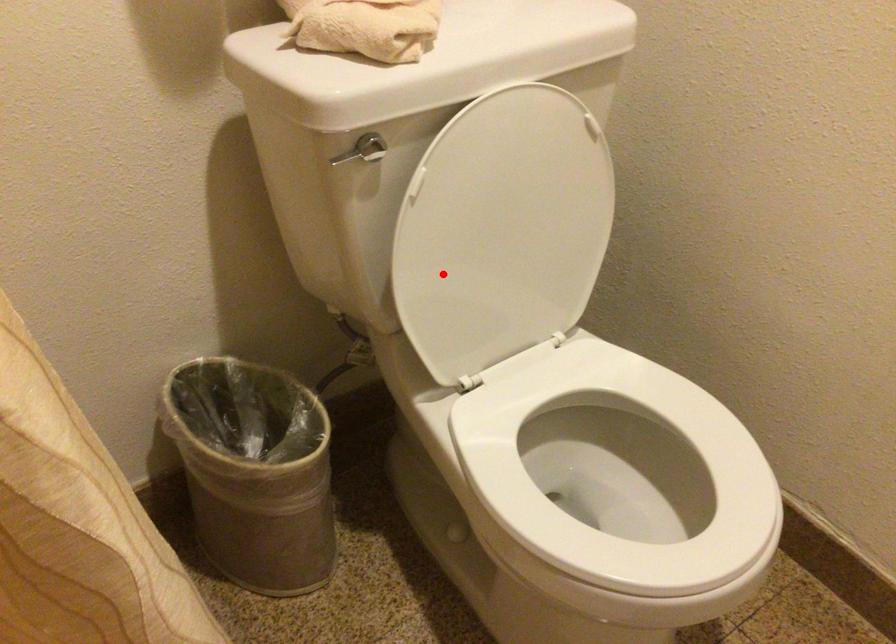
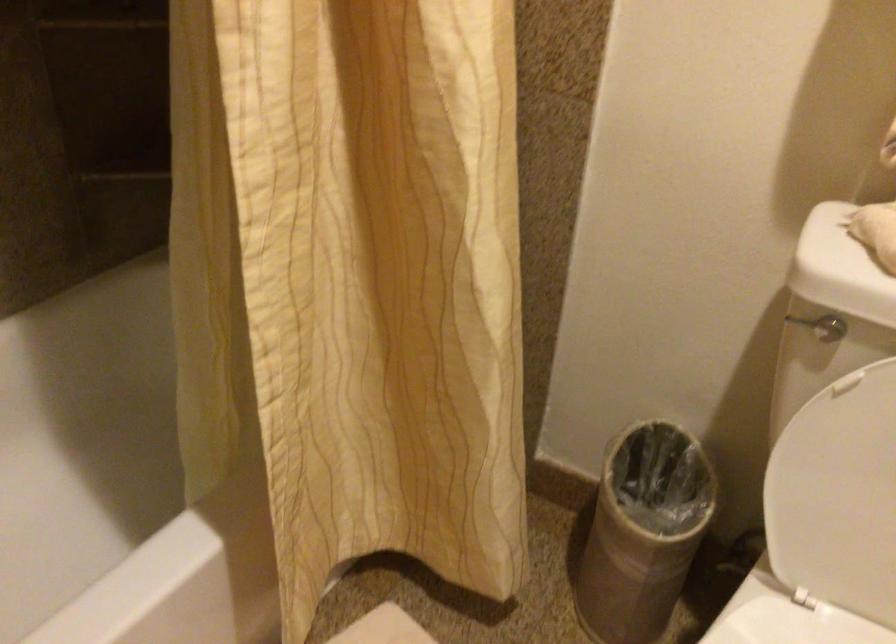
Find the pixel in the second image that matches the highlighted location in the first image.

(834, 480)